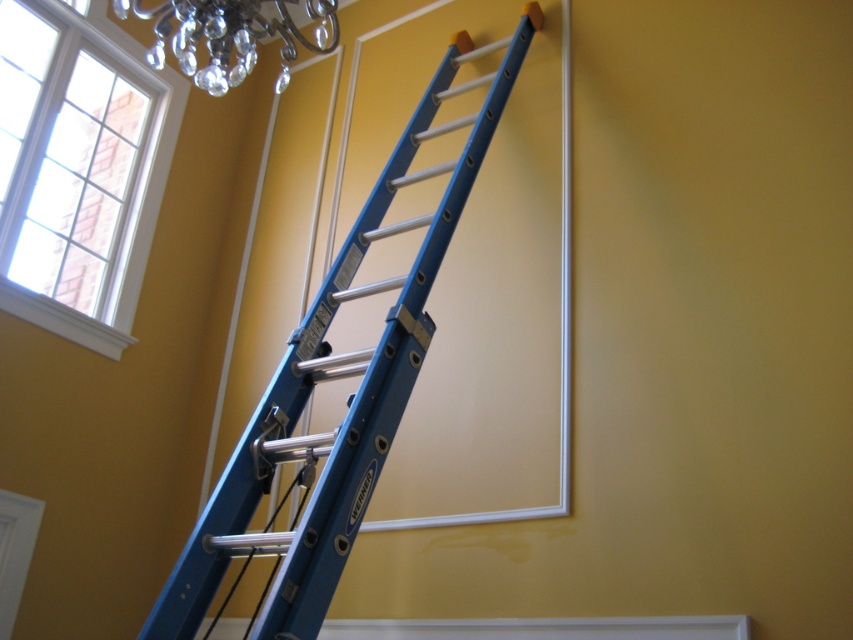
What do you see at coordinates (337, 378) in the screenshot? This screenshot has width=853, height=640. I see `blue metallic ladder at upper right` at bounding box center [337, 378].

Is point (473, 179) farther from camera compared to point (186, 42)?

Yes, it is behind point (186, 42).

At what (x,y) coordinates should I click in order to perform the action: click on blue metallic ladder at upper right. Please return your answer as a coordinate pair (x, y). Image resolution: width=853 pixels, height=640 pixels. Looking at the image, I should click on 337,378.

Is clear glass window at upper left to the left of crystal glass chandelier at upper left from the viewer's perspective?

Correct, you'll find clear glass window at upper left to the left of crystal glass chandelier at upper left.

Which is behind, point (19, 269) or point (166, 40)?

Point (166, 40)

In order to click on clear glass window at upper left in this screenshot , I will do `click(83, 173)`.

Is blue metallic ladder at upper right bigger than clear glass window at upper left?

Indeed, blue metallic ladder at upper right has a larger size compared to clear glass window at upper left.

Does blue metallic ladder at upper right appear on the left side of clear glass window at upper left?

Incorrect, blue metallic ladder at upper right is not on the left side of clear glass window at upper left.

Measure the distance between blue metallic ladder at upper right and camera.

blue metallic ladder at upper right and camera are 1.85 meters apart from each other.

The height and width of the screenshot is (640, 853). Find the location of `blue metallic ladder at upper right`. blue metallic ladder at upper right is located at coordinates 337,378.